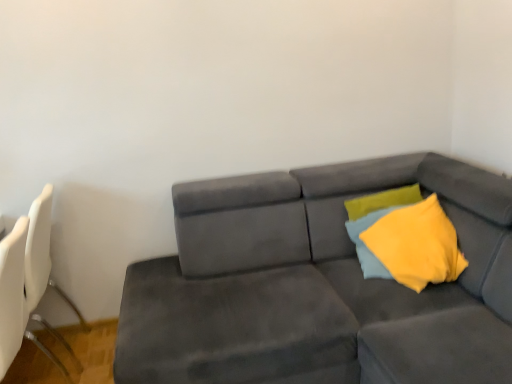
Question: Can you confirm if suede gray couch at center is shorter than soft yellow fabric pillow at right?

Choices:
 (A) yes
 (B) no

Answer: (B)

Question: Could you tell me if suede gray couch at center is turned towards soft yellow fabric pillow at right?

Choices:
 (A) no
 (B) yes

Answer: (A)

Question: From the image's perspective, is suede gray couch at center on soft yellow fabric pillow at right?

Choices:
 (A) no
 (B) yes

Answer: (A)

Question: Considering the relative sizes of suede gray couch at center and soft yellow fabric pillow at right in the image provided, is suede gray couch at center thinner than soft yellow fabric pillow at right?

Choices:
 (A) yes
 (B) no

Answer: (B)

Question: Is suede gray couch at center taller than soft yellow fabric pillow at right?

Choices:
 (A) yes
 (B) no

Answer: (A)

Question: From the image's perspective, is white plastic swivel chair at left located above or below yellow fabric pillow at upper right?

Choices:
 (A) above
 (B) below

Answer: (B)

Question: In the image, is white plastic swivel chair at left positioned in front of or behind yellow fabric pillow at upper right?

Choices:
 (A) behind
 (B) front

Answer: (B)

Question: In terms of width, does white plastic swivel chair at left look wider or thinner when compared to yellow fabric pillow at upper right?

Choices:
 (A) wide
 (B) thin

Answer: (A)

Question: Is white plastic swivel chair at left inside the boundaries of yellow fabric pillow at upper right, or outside?

Choices:
 (A) outside
 (B) inside

Answer: (A)

Question: In the image, is suede gray couch at center on the left side or the right side of soft yellow fabric pillow at right?

Choices:
 (A) right
 (B) left

Answer: (B)

Question: Does point (371, 170) appear closer or farther from the camera than point (358, 221)?

Choices:
 (A) farther
 (B) closer

Answer: (A)

Question: Relative to soft yellow fabric pillow at right, is suede gray couch at center in front or behind?

Choices:
 (A) behind
 (B) front

Answer: (B)

Question: Is suede gray couch at center inside or outside of soft yellow fabric pillow at right?

Choices:
 (A) outside
 (B) inside

Answer: (A)

Question: Considering the positions of suede gray couch at center and white plastic swivel chair at left in the image, is suede gray couch at center bigger or smaller than white plastic swivel chair at left?

Choices:
 (A) big
 (B) small

Answer: (A)

Question: From the image's perspective, relative to white plastic swivel chair at left, is suede gray couch at center above or below?

Choices:
 (A) above
 (B) below

Answer: (B)